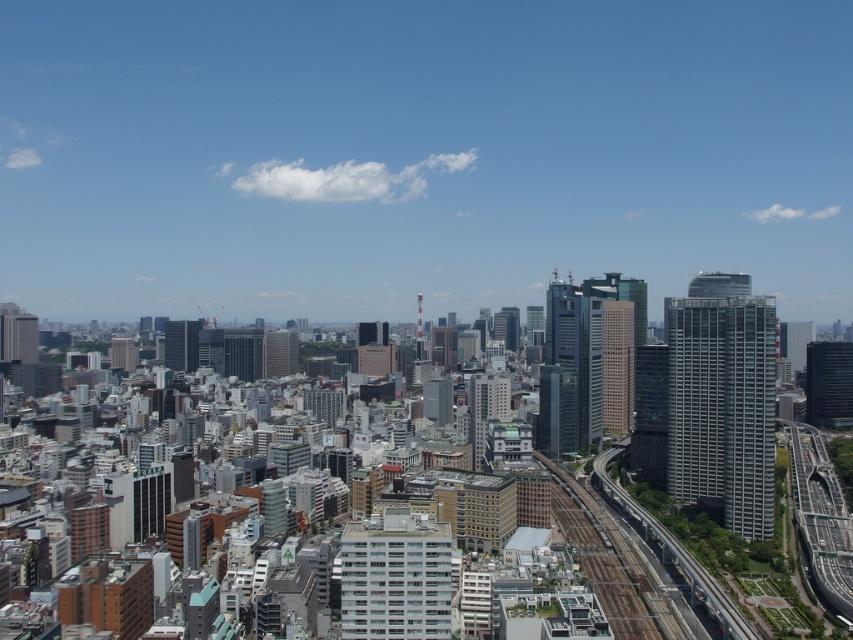
You are a city planner assessing the urban layout. Given the presence of the metallic gray train track at lower right and the glassy gray skyscraper at center, which structure occupies more horizontal space in the scene?

The metallic gray train track at lower right might be wider than the glassy gray skyscraper at center, so it likely occupies more horizontal space in the scene.

You are standing at the railway line in the city and see two points marked in the image. The first point is at coordinates point [718,285] and the second is at point [194,349]. Which of these two points is closer to you?

Point [718,285] is in front of point [194,349], so it is closer to you.